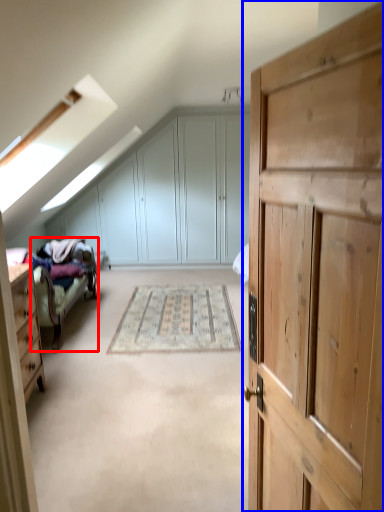
Question: Which object appears closest to the camera in this image, bed frame (highlighted by a red box) or cupboard (highlighted by a blue box)?

Choices:
 (A) bed frame
 (B) cupboard

Answer: (B)